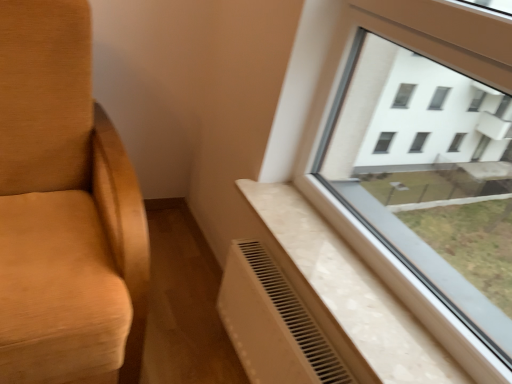
Question: Considering the relative sizes of white textured radiator at lower right and white plastic radiator at lower center in the image provided, is white textured radiator at lower right thinner than white plastic radiator at lower center?

Choices:
 (A) no
 (B) yes

Answer: (A)

Question: Can white plastic radiator at lower center be found inside white textured radiator at lower right?

Choices:
 (A) yes
 (B) no

Answer: (B)

Question: Can you confirm if white textured radiator at lower right is wider than white plastic radiator at lower center?

Choices:
 (A) yes
 (B) no

Answer: (A)

Question: Considering the relative sizes of white textured radiator at lower right and white plastic radiator at lower center in the image provided, is white textured radiator at lower right smaller than white plastic radiator at lower center?

Choices:
 (A) yes
 (B) no

Answer: (A)

Question: Is white textured radiator at lower right oriented away from white plastic radiator at lower center?

Choices:
 (A) yes
 (B) no

Answer: (B)

Question: Is white textured radiator at lower right further to camera compared to white plastic radiator at lower center?

Choices:
 (A) yes
 (B) no

Answer: (B)

Question: Does white plastic radiator at lower center come in front of white textured radiator at lower right?

Choices:
 (A) yes
 (B) no

Answer: (B)

Question: From the image's perspective, is white plastic radiator at lower center located above white textured radiator at lower right?

Choices:
 (A) yes
 (B) no

Answer: (B)

Question: Could white textured radiator at lower right be considered to be inside white plastic radiator at lower center?

Choices:
 (A) no
 (B) yes

Answer: (A)

Question: Can you confirm if white plastic radiator at lower center is wider than white textured radiator at lower right?

Choices:
 (A) yes
 (B) no

Answer: (B)

Question: Does white plastic radiator at lower center have a larger size compared to white textured radiator at lower right?

Choices:
 (A) yes
 (B) no

Answer: (A)

Question: Is white plastic radiator at lower center thinner than white textured radiator at lower right?

Choices:
 (A) no
 (B) yes

Answer: (B)

Question: In terms of size, does white textured radiator at lower right appear bigger or smaller than white plastic radiator at lower center?

Choices:
 (A) small
 (B) big

Answer: (A)